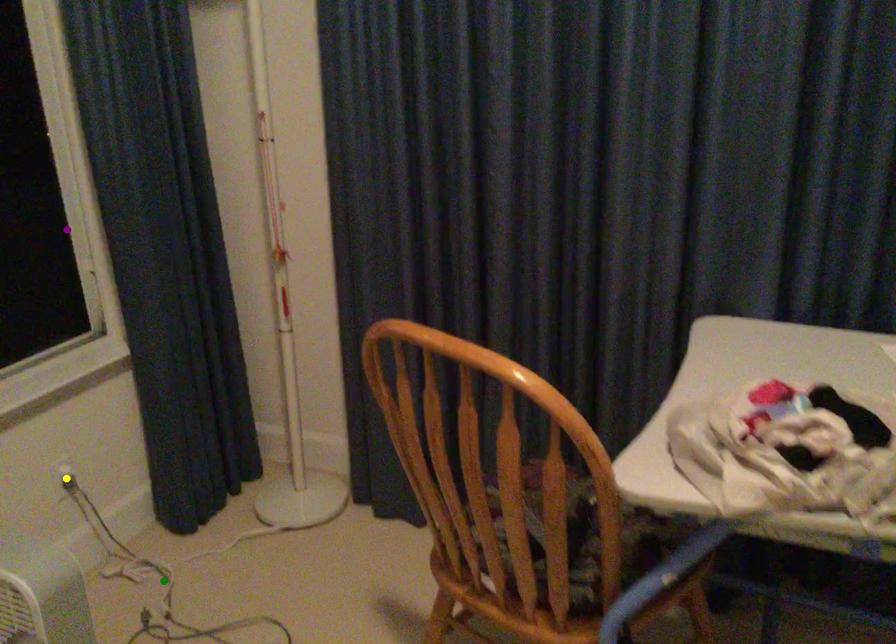
Order these from farthest to nearest:
yellow point, purple point, green point

purple point, green point, yellow point